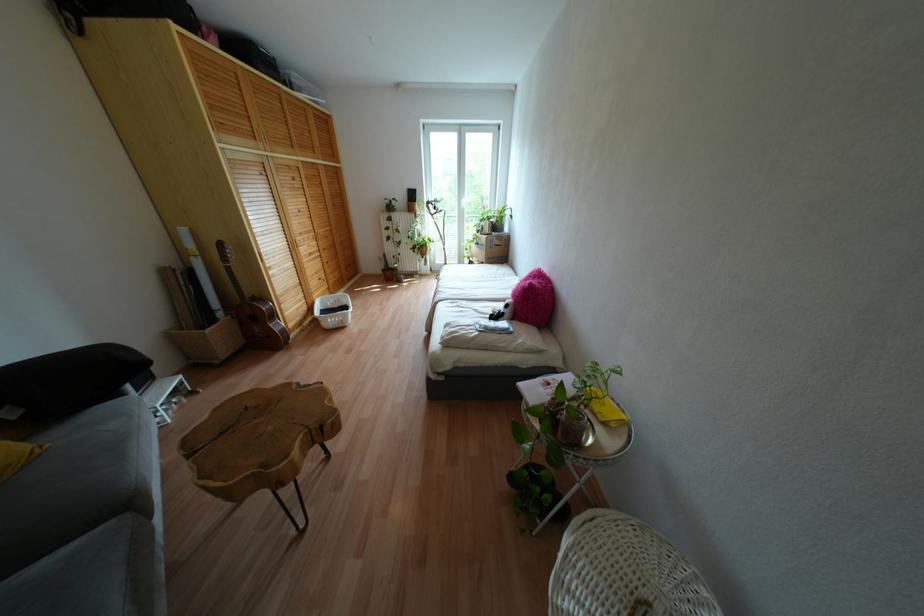
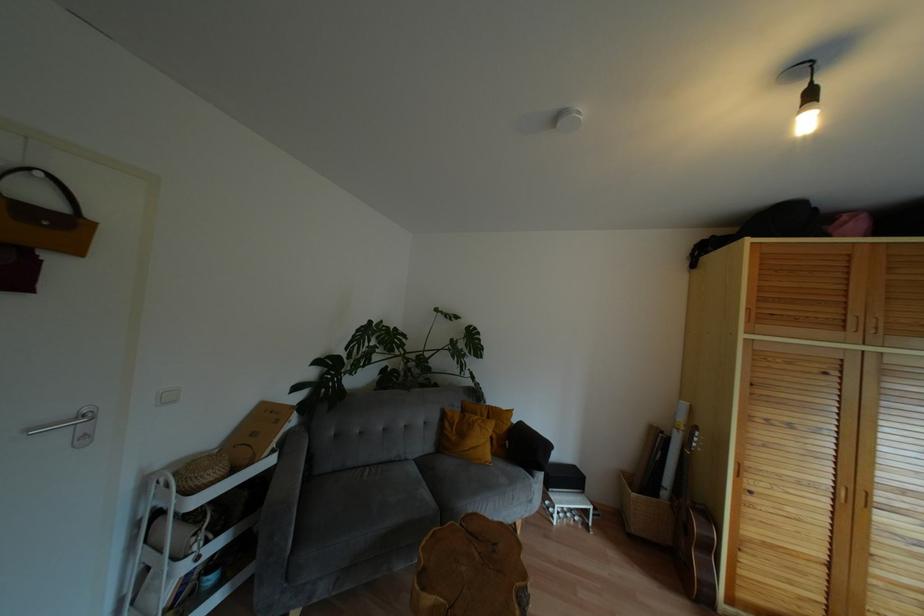
Question: The camera is either moving clockwise (left) or counter-clockwise (right) around the object. The first image is from the beginning of the video and the second image is from the end. Is the camera moving left or right when shooting the video?

Choices:
 (A) Left
 (B) Right

Answer: (B)